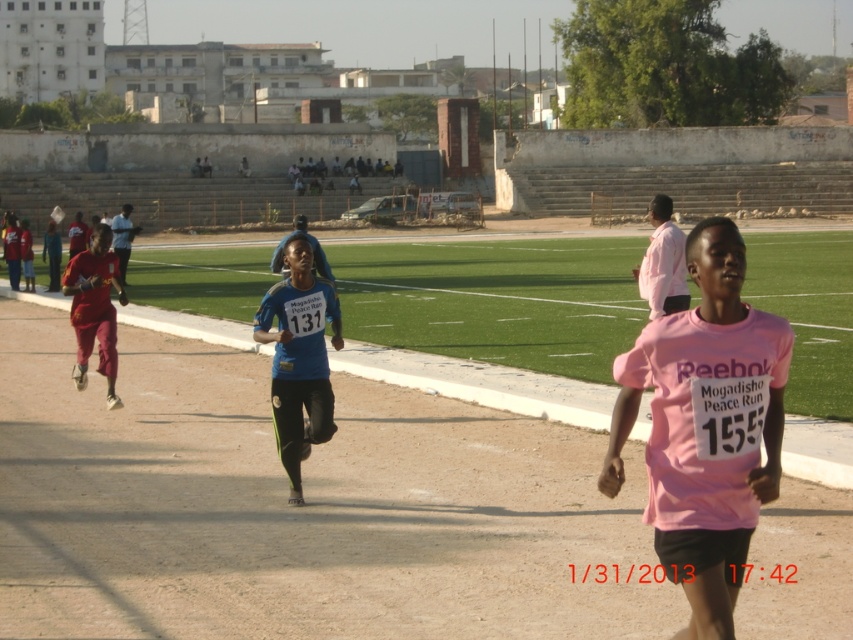
Question: Is pink matte shirt at center below blue matte running shirt at center?

Choices:
 (A) no
 (B) yes

Answer: (B)

Question: Which point is farther from the camera taking this photo?

Choices:
 (A) (297, 244)
 (B) (93, 298)

Answer: (B)

Question: Estimate the real-world distances between objects in this image. Which object is farther from the matte red shorts at left?

Choices:
 (A) pink matte shirt at center
 (B) blue matte running shirt at center

Answer: (A)

Question: Can you confirm if pink matte shirt at center is thinner than matte red shorts at left?

Choices:
 (A) no
 (B) yes

Answer: (B)

Question: In this image, where is blue matte running shirt at center located relative to matte red shorts at left?

Choices:
 (A) right
 (B) left

Answer: (A)

Question: Which point is farther to the camera?

Choices:
 (A) pink matte shirt at center
 (B) blue matte running shirt at center
 (C) matte red shorts at left

Answer: (C)